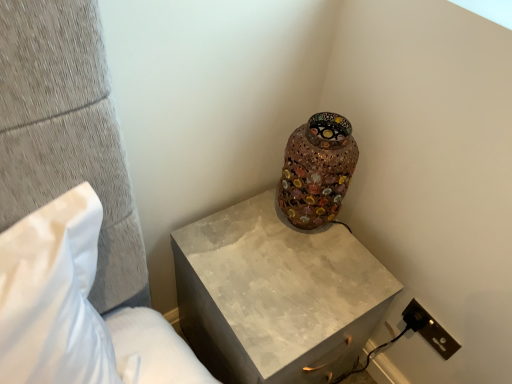
At what (x,y) coordinates should I click in order to perform the action: click on vacant space situated on the left part of mosaic glass vase at upper right. Please return your answer as a coordinate pair (x, y). The image size is (512, 384). Looking at the image, I should click on point(238,225).